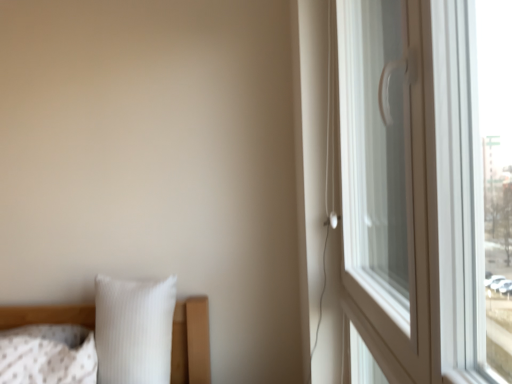
Question: From a real-world perspective, is white ribbed pillow at lower left, which appears as the second pillow when viewed from the left, on top of white glossy window handle at right?

Choices:
 (A) no
 (B) yes

Answer: (A)

Question: Does white ribbed pillow at lower left, which is counted as the first pillow, starting from the right, have a lesser height compared to white glossy window handle at right?

Choices:
 (A) no
 (B) yes

Answer: (B)

Question: From the image's perspective, does white ribbed pillow at lower left, which appears as the second pillow when viewed from the left, appear lower than white glossy window handle at right?

Choices:
 (A) no
 (B) yes

Answer: (B)

Question: From a real-world perspective, is white ribbed pillow at lower left, which appears as the second pillow when viewed from the left, below white glossy window handle at right?

Choices:
 (A) no
 (B) yes

Answer: (B)

Question: Considering the relative positions of white ribbed pillow at lower left, which is counted as the first pillow, starting from the right, and white glossy window handle at right in the image provided, is white ribbed pillow at lower left, which is counted as the first pillow, starting from the right, to the left of white glossy window handle at right from the viewer's perspective?

Choices:
 (A) no
 (B) yes

Answer: (B)

Question: Does white ribbed pillow at lower left, which is counted as the first pillow, starting from the right, have a greater height compared to white glossy window handle at right?

Choices:
 (A) yes
 (B) no

Answer: (B)

Question: Is white textured pillow at lower left, marked as the 1th pillow in a left-to-right arrangement, wider than white glossy window handle at right?

Choices:
 (A) no
 (B) yes

Answer: (B)

Question: Is white textured pillow at lower left, marked as the 1th pillow in a left-to-right arrangement, aimed at white glossy window handle at right?

Choices:
 (A) yes
 (B) no

Answer: (B)

Question: Is white textured pillow at lower left, marked as the 1th pillow in a left-to-right arrangement, thinner than white glossy window handle at right?

Choices:
 (A) yes
 (B) no

Answer: (B)

Question: Can you confirm if white textured pillow at lower left, the 2th pillow in the right-to-left sequence, is positioned to the left of white glossy window handle at right?

Choices:
 (A) no
 (B) yes

Answer: (B)

Question: From a real-world perspective, is white textured pillow at lower left, marked as the 1th pillow in a left-to-right arrangement, on white glossy window handle at right?

Choices:
 (A) no
 (B) yes

Answer: (A)

Question: Considering the relative sizes of white textured pillow at lower left, marked as the 1th pillow in a left-to-right arrangement, and white glossy window handle at right in the image provided, is white textured pillow at lower left, marked as the 1th pillow in a left-to-right arrangement, shorter than white glossy window handle at right?

Choices:
 (A) no
 (B) yes

Answer: (B)

Question: Could you tell me if white glossy window handle at right is facing white ribbed pillow at lower left, which is counted as the first pillow, starting from the right?

Choices:
 (A) yes
 (B) no

Answer: (A)